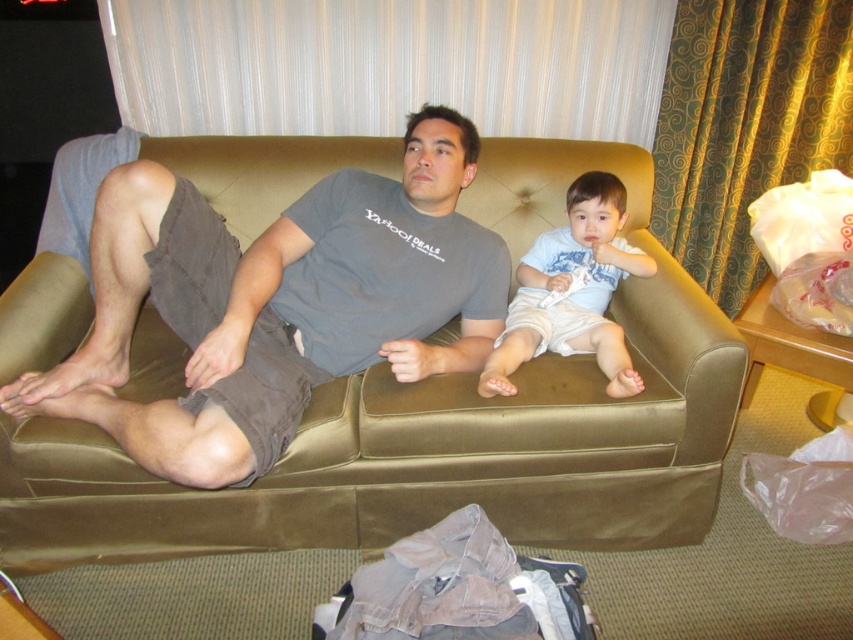
Question: Does suede-like brown couch at center appear on the right side of white cotton shirt at center?

Choices:
 (A) yes
 (B) no

Answer: (B)

Question: Is suede-like brown couch at center positioned at the back of white cotton shirt at center?

Choices:
 (A) no
 (B) yes

Answer: (A)

Question: Is suede-like brown couch at center to the right of white cotton shirt at center from the viewer's perspective?

Choices:
 (A) yes
 (B) no

Answer: (B)

Question: Which point is farther to the camera?

Choices:
 (A) suede-like brown couch at center
 (B) white cotton shirt at center

Answer: (B)